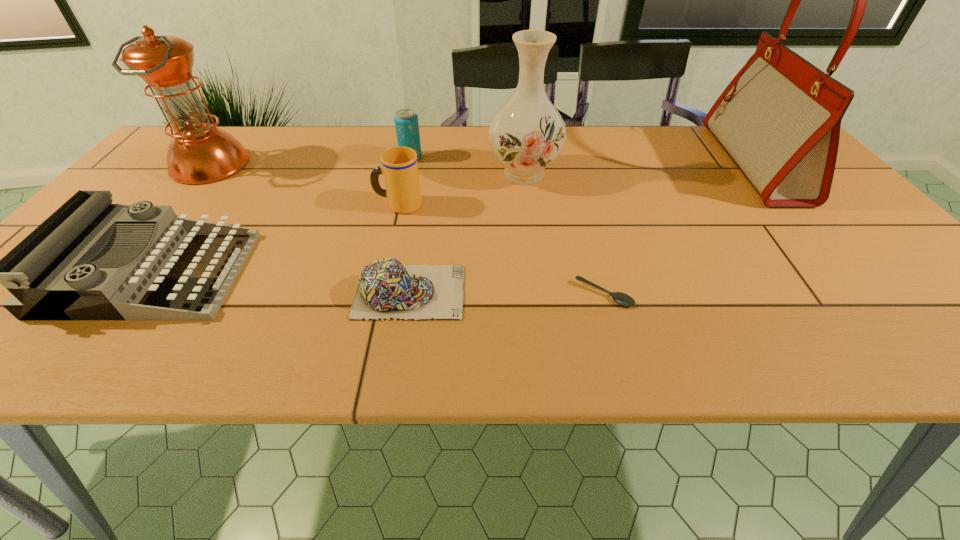
Image resolution: width=960 pixels, height=540 pixels. I want to click on the rightmost object, so click(x=779, y=119).

Where is `the tallest object`? the tallest object is located at coordinates (779, 119).

At what (x,y) coordinates should I click in order to perform the action: click on oil lamp. Please return your answer as a coordinate pair (x, y). This screenshot has height=540, width=960. Looking at the image, I should click on (199, 152).

Where is `vase`? vase is located at coordinates (527, 133).

At what (x,y) coordinates should I click in order to perform the action: click on cup. Please return your answer as a coordinate pair (x, y). The image size is (960, 540). Looking at the image, I should click on (399, 167).

Where is `soda can`? This screenshot has height=540, width=960. soda can is located at coordinates (406, 120).

You are a GUI agent. You are given a task and a screenshot of the screen. Output one action in this format:
    pyautogui.click(x=<x>, y=<y>)
    Task: Click on the typewriter
    The height and width of the screenshot is (540, 960).
    Given the screenshot: What is the action you would take?
    pyautogui.click(x=47, y=273)

Where is `cap`? Image resolution: width=960 pixels, height=540 pixels. cap is located at coordinates (385, 289).

Find the location of a particular element. The width and height of the screenshot is (960, 540). soupspoon is located at coordinates (623, 299).

Locate an element on the screen. This screenshot has width=960, height=540. vacant space located on the left of the rightmost object is located at coordinates (680, 164).